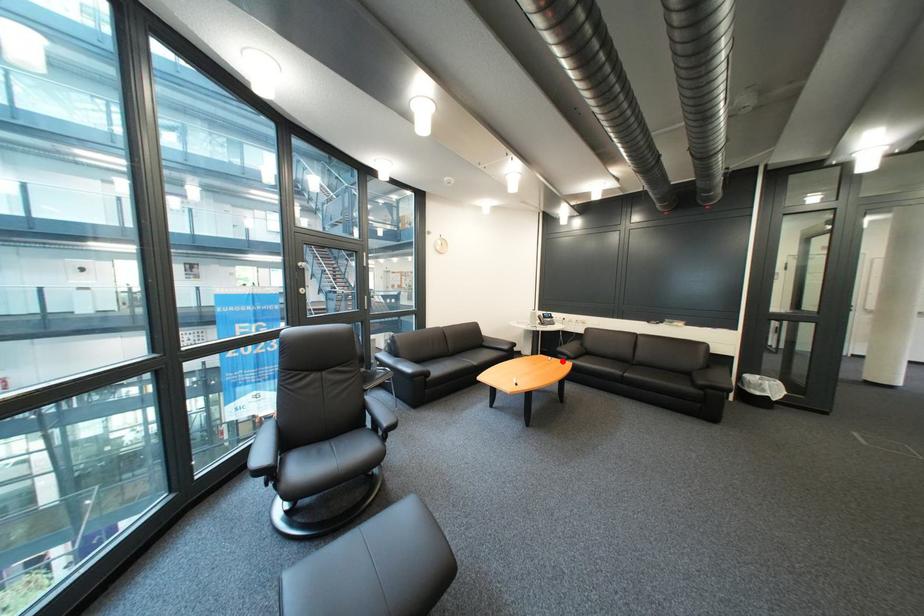
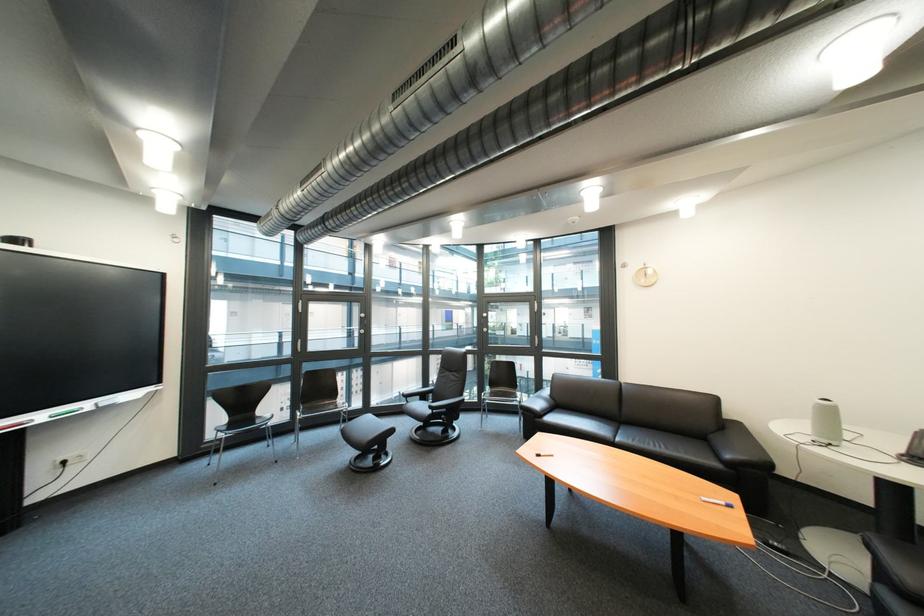
Question: A red point is marked in image1. In image2, is the corresponding 3D point closer to the camera or farther? Reply with the corresponding letter.

Choices:
 (A) The corresponding 3D point is closer.
 (B) The corresponding 3D point is farther.

Answer: (B)